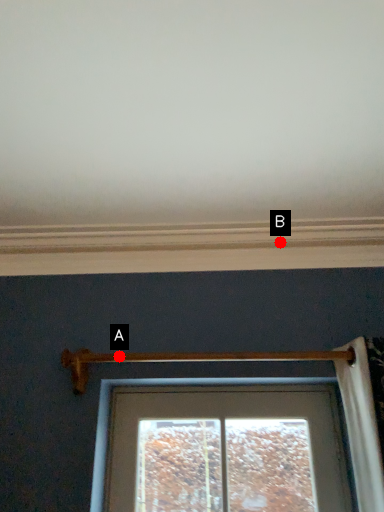
Question: Two points are circled on the image, labeled by A and B beside each circle. Which point is farther to the camera?

Choices:
 (A) A is further
 (B) B is further

Answer: (B)